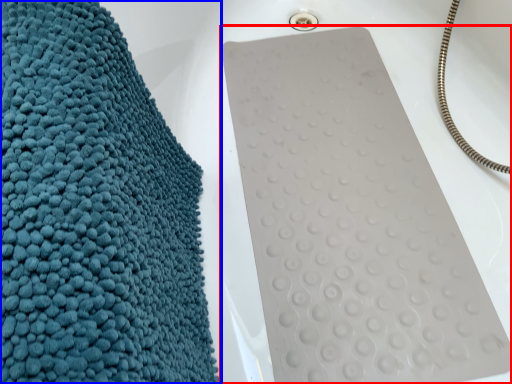
Question: Which object is closer to the camera taking this photo, bath towel (highlighted by a red box) or towel (highlighted by a blue box)?

Choices:
 (A) bath towel
 (B) towel

Answer: (B)